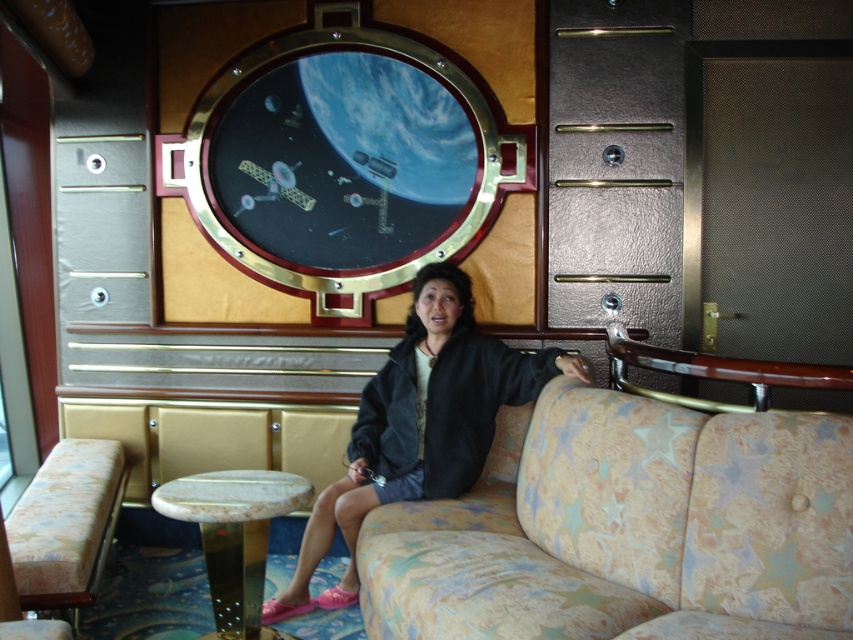
Question: Among these objects, which one is nearest to the camera?

Choices:
 (A) white marble stool at lower center
 (B) beige star-patterned fabric couch at center
 (C) black soft fabric robe at center

Answer: (B)

Question: Among these objects, which one is nearest to the camera?

Choices:
 (A) white marble stool at lower center
 (B) black fabric jacket at center
 (C) beige star-patterned fabric couch at center
 (D) black soft fabric robe at center

Answer: (C)

Question: Considering the relative positions of beige star-patterned fabric couch at center and beige fabric stool at lower left in the image provided, where is beige star-patterned fabric couch at center located with respect to beige fabric stool at lower left?

Choices:
 (A) above
 (B) below

Answer: (A)

Question: Estimate the real-world distances between objects in this image. Which object is closer to the beige star-patterned fabric couch at center?

Choices:
 (A) beige fabric stool at lower left
 (B) black fabric jacket at center
 (C) white marble stool at lower center
 (D) black soft fabric robe at center

Answer: (D)

Question: Is black fabric jacket at center above beige fabric stool at lower left?

Choices:
 (A) yes
 (B) no

Answer: (A)

Question: Is black soft fabric robe at center further to the viewer compared to white marble stool at lower center?

Choices:
 (A) no
 (B) yes

Answer: (B)